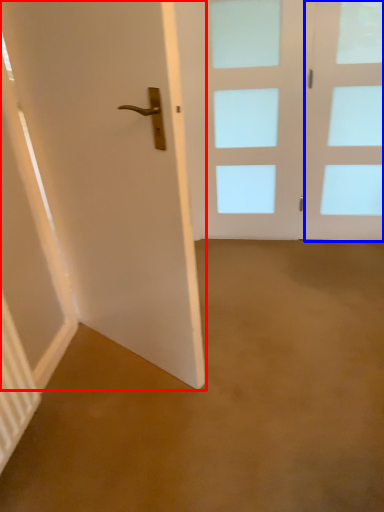
Question: Which object is closer to the camera taking this photo, door (highlighted by a red box) or glass door (highlighted by a blue box)?

Choices:
 (A) door
 (B) glass door

Answer: (A)